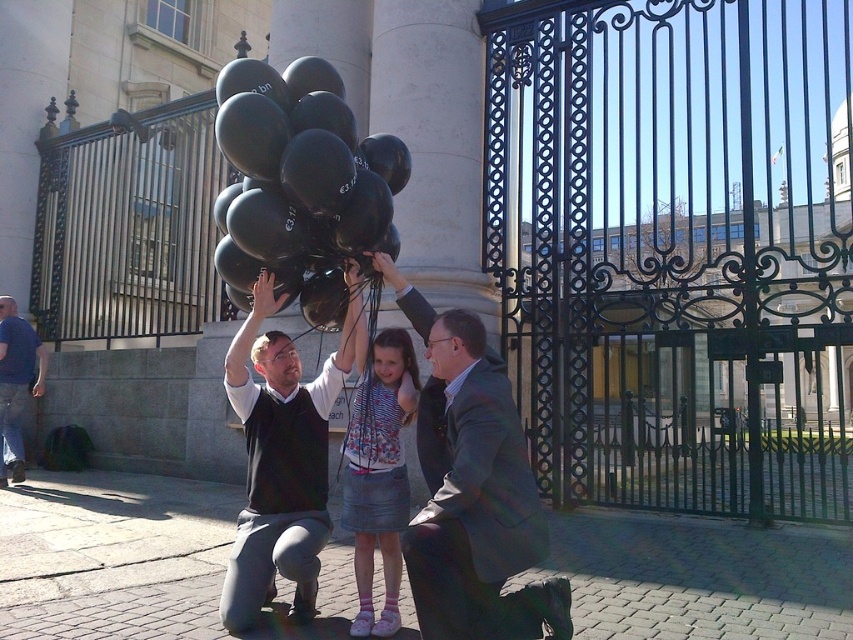
Question: Which point is closer to the camera?

Choices:
 (A) matte black hair at center
 (B) matte black suit at center
 (C) matte black sweater at center

Answer: (B)

Question: Is the position of black matte balloons at center less distant than that of matte black hair at center?

Choices:
 (A) yes
 (B) no

Answer: (A)

Question: Which point appears closest to the camera in this image?

Choices:
 (A) (9, 364)
 (B) (276, 374)
 (C) (471, 358)

Answer: (C)

Question: Which point is farther from the camera taking this photo?

Choices:
 (A) (6, 312)
 (B) (386, 339)
 (C) (511, 621)
 (D) (241, 92)

Answer: (A)

Question: Is the position of denim skirt at center more distant than that of matte black hair at center?

Choices:
 (A) yes
 (B) no

Answer: (B)

Question: Considering the relative positions of black matte balloons at center and smooth gray suit at center in the image provided, where is black matte balloons at center located with respect to smooth gray suit at center?

Choices:
 (A) below
 (B) above

Answer: (B)